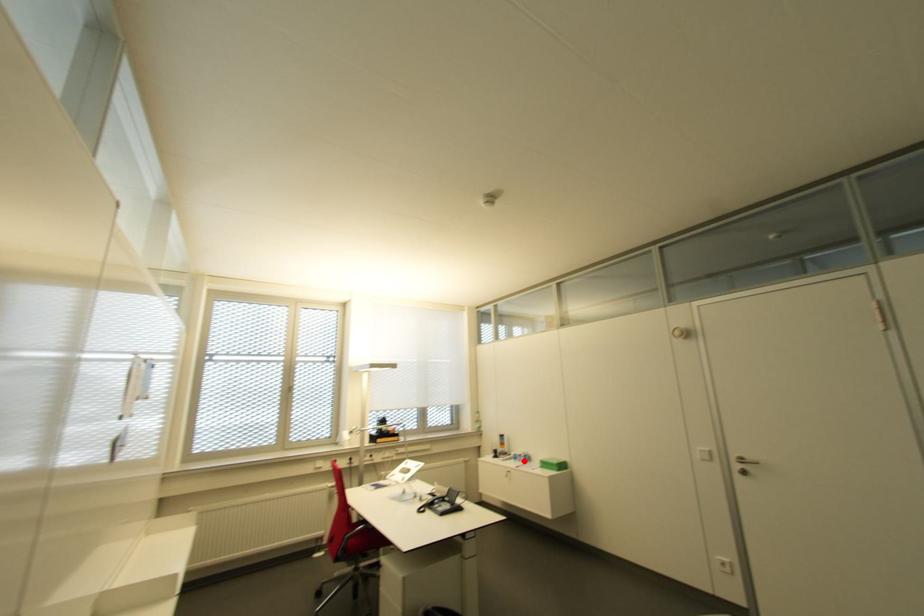
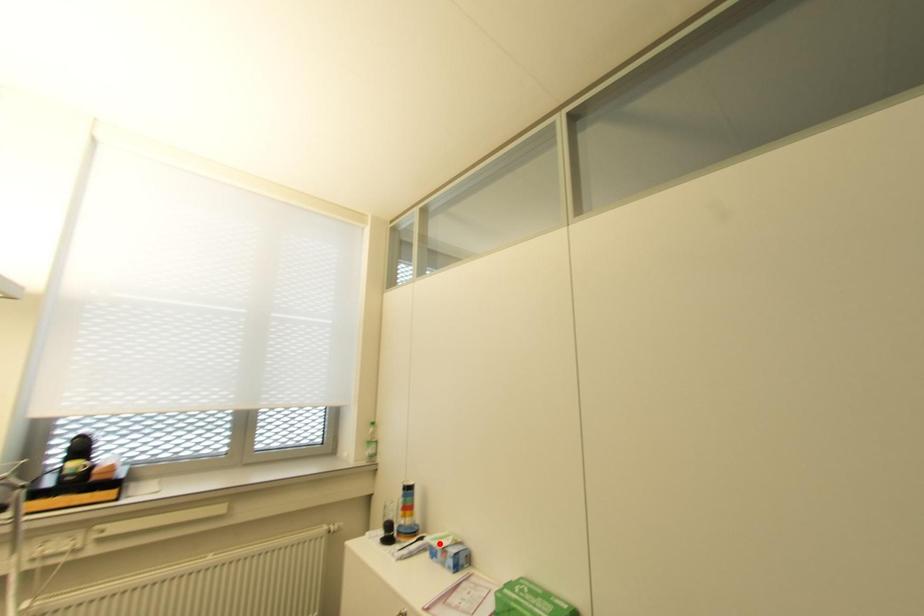
I am providing you with two images of the same scene from different viewpoints. A red point is marked on the first image and another point is marked on the second image. Is the marked point in image1 the same physical position as the marked point in image2?

No